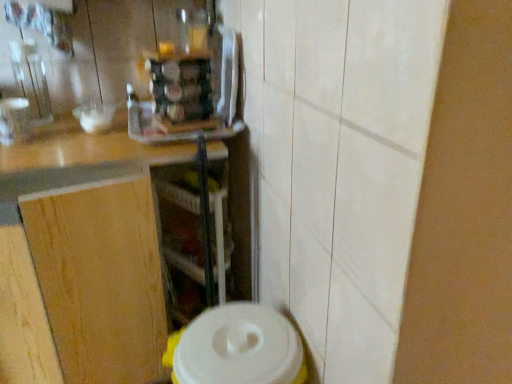
Question: From the image's perspective, is wooden at left above white plastic container at lower center?

Choices:
 (A) yes
 (B) no

Answer: (A)

Question: Is wooden at left positioned far away from white plastic container at lower center?

Choices:
 (A) yes
 (B) no

Answer: (B)

Question: From a real-world perspective, is wooden at left over white plastic container at lower center?

Choices:
 (A) yes
 (B) no

Answer: (A)

Question: Is wooden at left wider than white plastic container at lower center?

Choices:
 (A) yes
 (B) no

Answer: (A)

Question: Is wooden at left shorter than white plastic container at lower center?

Choices:
 (A) yes
 (B) no

Answer: (B)

Question: Is point (202, 344) closer or farther from the camera than point (159, 200)?

Choices:
 (A) closer
 (B) farther

Answer: (A)

Question: Visually, is white plastic container at lower center positioned to the left or to the right of transparent plastic shelf at center?

Choices:
 (A) right
 (B) left

Answer: (A)

Question: Do you think white plastic container at lower center is within transparent plastic shelf at center, or outside of it?

Choices:
 (A) outside
 (B) inside

Answer: (A)

Question: Looking at their shapes, would you say white plastic container at lower center is wider or thinner than transparent plastic shelf at center?

Choices:
 (A) wide
 (B) thin

Answer: (A)

Question: From the image's perspective, relative to wooden at left, is transparent plastic shelf at center above or below?

Choices:
 (A) below
 (B) above

Answer: (A)

Question: Considering the positions of transparent plastic shelf at center and wooden at left in the image, is transparent plastic shelf at center wider or thinner than wooden at left?

Choices:
 (A) thin
 (B) wide

Answer: (A)

Question: From a real-world perspective, is transparent plastic shelf at center above or below wooden at left?

Choices:
 (A) below
 (B) above

Answer: (A)

Question: In the image, is transparent plastic shelf at center positioned in front of or behind wooden at left?

Choices:
 (A) behind
 (B) front

Answer: (A)

Question: Considering the positions of wooden at left and transparent plastic shelf at center in the image, is wooden at left bigger or smaller than transparent plastic shelf at center?

Choices:
 (A) big
 (B) small

Answer: (A)

Question: In the image, is wooden at left positioned in front of or behind transparent plastic shelf at center?

Choices:
 (A) front
 (B) behind

Answer: (A)